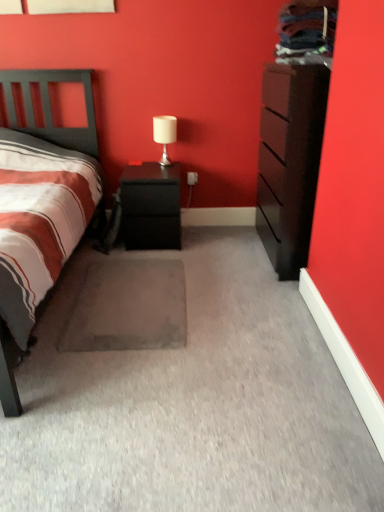
I want to click on vacant space in gray carpet at center (from a real-world perspective), so click(x=127, y=301).